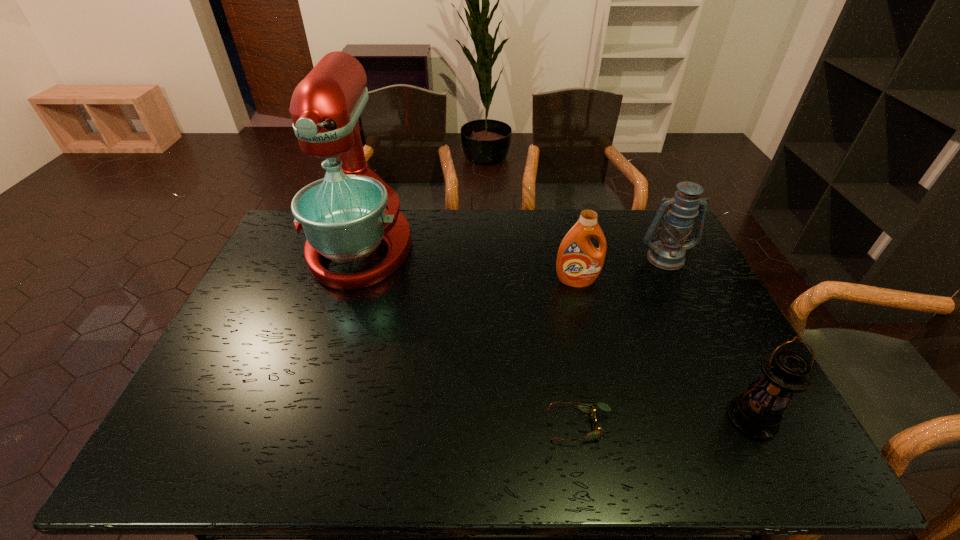
The image size is (960, 540). In order to click on vacant space at the far edge of the desktop in this screenshot , I will do `click(525, 220)`.

Where is `free space at the near edge of the desktop`? This screenshot has width=960, height=540. free space at the near edge of the desktop is located at coordinates (439, 459).

Locate an element on the screen. The image size is (960, 540). vacant space at the left edge of the desktop is located at coordinates (206, 380).

This screenshot has height=540, width=960. Find the location of `vacant space at the right edge`. vacant space at the right edge is located at coordinates (718, 309).

Where is `free spot between the farther lantern and the detergent`? This screenshot has height=540, width=960. free spot between the farther lantern and the detergent is located at coordinates (621, 269).

You are a GUI agent. You are given a task and a screenshot of the screen. Output one action in this format:
    pyautogui.click(x=<x>, y=<y>)
    Task: Click on the vacant area between the shortest object and the mixer
    The height and width of the screenshot is (540, 960).
    Given the screenshot: What is the action you would take?
    pyautogui.click(x=470, y=336)

Identify the location of free point between the farther lantern and the leftmost object. The height and width of the screenshot is (540, 960). tap(513, 252).

Locate an element on the screen. The height and width of the screenshot is (540, 960). free space between the farther lantern and the nearer lantern is located at coordinates (708, 339).

You are a GUI agent. You are given a task and a screenshot of the screen. Output one action in this format:
    pyautogui.click(x=<x>, y=<y>)
    Task: Click on the free space between the detergent and the nearer lantern
    The width and height of the screenshot is (960, 540).
    Given the screenshot: What is the action you would take?
    pyautogui.click(x=664, y=351)

The height and width of the screenshot is (540, 960). I want to click on empty space between the detergent and the nearer lantern, so click(x=664, y=351).